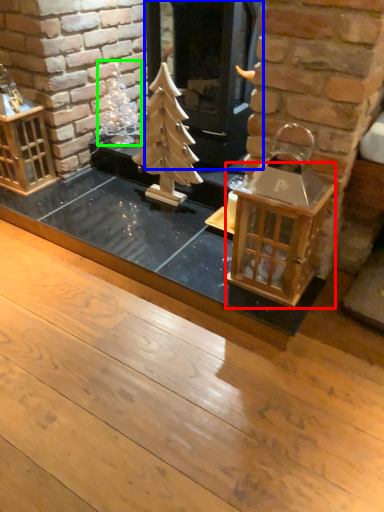
Question: Estimate the real-world distances between objects in this image. Which object is farther from table (highlighted by a red box), fireplace (highlighted by a blue box) or christmas decoration (highlighted by a green box)?

Choices:
 (A) fireplace
 (B) christmas decoration

Answer: (B)